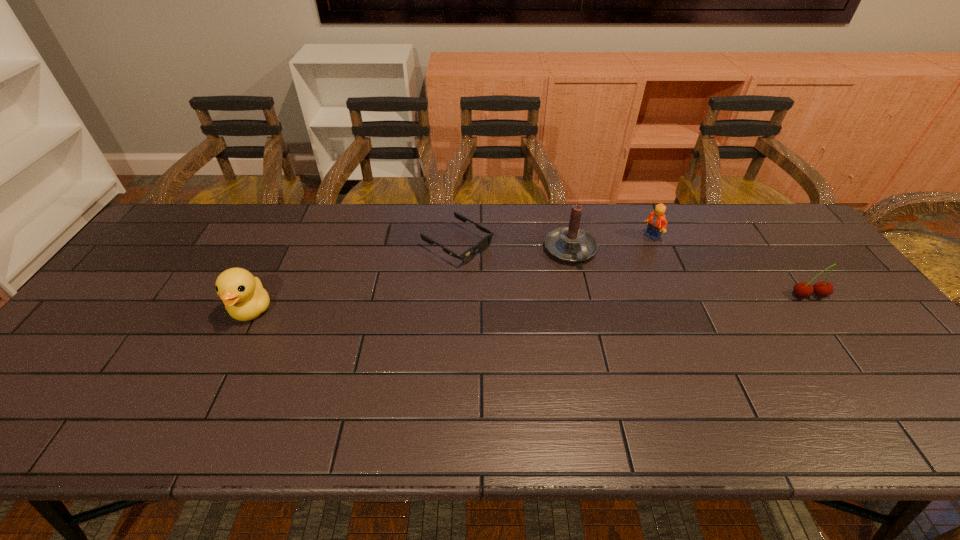
You are a GUI agent. You are given a task and a screenshot of the screen. Output one action in this format:
    pyautogui.click(x=<x>, y=<y>)
    Task: Click on the object that is at the right edge
    
    Given the screenshot: What is the action you would take?
    pyautogui.click(x=822, y=288)

The width and height of the screenshot is (960, 540). I want to click on free point at the far edge, so click(401, 217).

In the image, there is a desktop. Where is `free region at the near edge`? Image resolution: width=960 pixels, height=540 pixels. free region at the near edge is located at coordinates (329, 394).

The height and width of the screenshot is (540, 960). Find the location of `vacant space at the left edge of the desktop`. vacant space at the left edge of the desktop is located at coordinates (137, 269).

Identify the location of vacant space at the right edge. (845, 305).

Identify the location of blank space at the far left corner. The image size is (960, 540). (170, 241).

In the image, there is a desktop. At what (x,y) coordinates should I click in order to perform the action: click on free space at the near left corner. Please return your answer as a coordinate pair (x, y). The width and height of the screenshot is (960, 540). Looking at the image, I should click on (91, 383).

You are a GUI agent. You are given a task and a screenshot of the screen. Output one action in this format:
    pyautogui.click(x=<x>, y=<y>)
    Task: Click on the free space that is in between the second object from left to right and the duck
    This screenshot has width=960, height=540.
    Given the screenshot: What is the action you would take?
    pyautogui.click(x=354, y=277)

Identify the location of vacant area between the duck and the sunglasses. pos(354,277).

The width and height of the screenshot is (960, 540). I want to click on free space between the rightmost object and the leftmost object, so click(x=531, y=303).